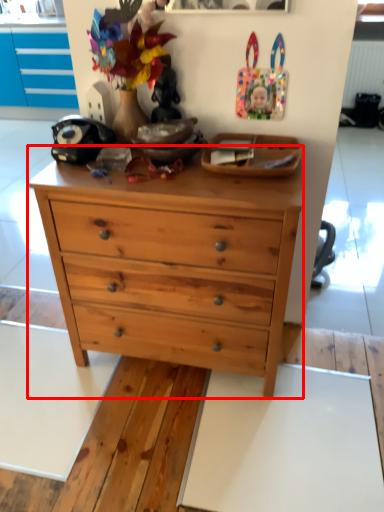
Question: From the image's perspective, considering the relative positions of chest of drawers (annotated by the red box) and plate in the image provided, where is chest of drawers (annotated by the red box) located with respect to the staircase?

Choices:
 (A) below
 (B) above

Answer: (A)